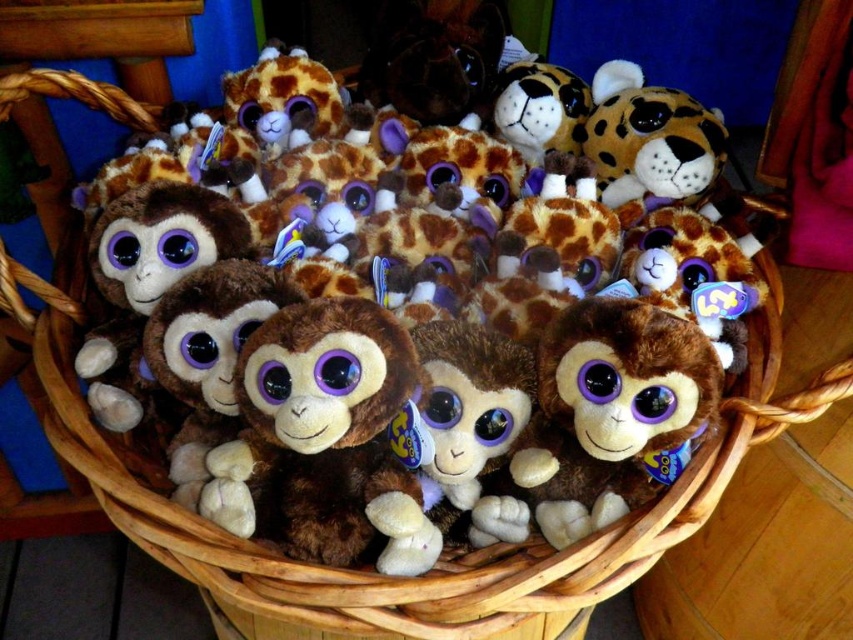
Between brown plush monkey at center and spotted brown plush at upper right, which one has less height?

spotted brown plush at upper right

Identify the location of brown plush monkey at center. The image size is (853, 640). point(610,412).